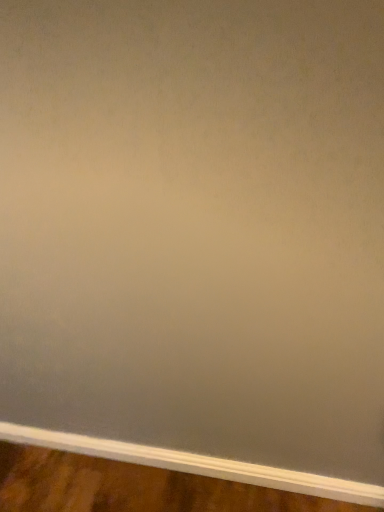
What do you see at coordinates (133, 488) in the screenshot?
I see `brown matte wood at bottom` at bounding box center [133, 488].

Locate an element on the screen. brown matte wood at bottom is located at coordinates (133, 488).

This screenshot has height=512, width=384. I want to click on brown matte wood at bottom, so click(133, 488).